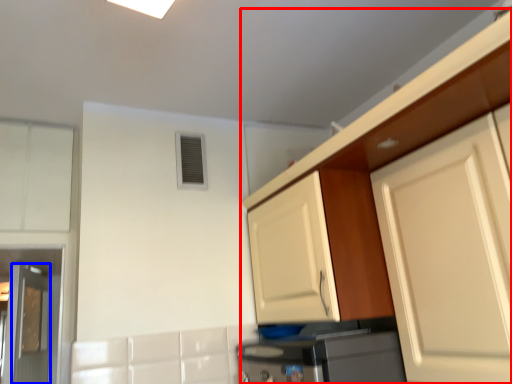
Question: Which of the following is the farthest to the observer, cabinetry (highlighted by a red box) or door (highlighted by a blue box)?

Choices:
 (A) cabinetry
 (B) door

Answer: (B)